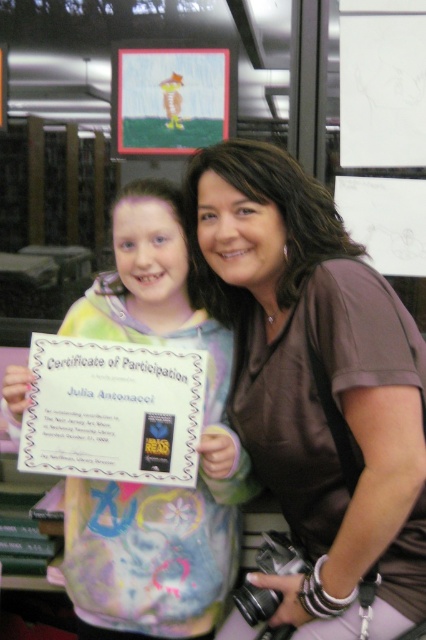
Question: Does brown satin blouse at center appear under pastel tie-dye hoodie at center?

Choices:
 (A) no
 (B) yes

Answer: (A)

Question: Among these objects, which one is farthest from the camera?

Choices:
 (A) brown satin blouse at center
 (B) pastel tie-dye hoodie at center

Answer: (B)

Question: Does brown satin blouse at center appear on the left side of pastel tie-dye hoodie at center?

Choices:
 (A) yes
 (B) no

Answer: (B)

Question: Which point is closer to the camera?

Choices:
 (A) (163, 628)
 (B) (207, 189)

Answer: (B)

Question: Is the position of brown satin blouse at center more distant than that of pastel tie-dye hoodie at center?

Choices:
 (A) no
 (B) yes

Answer: (A)